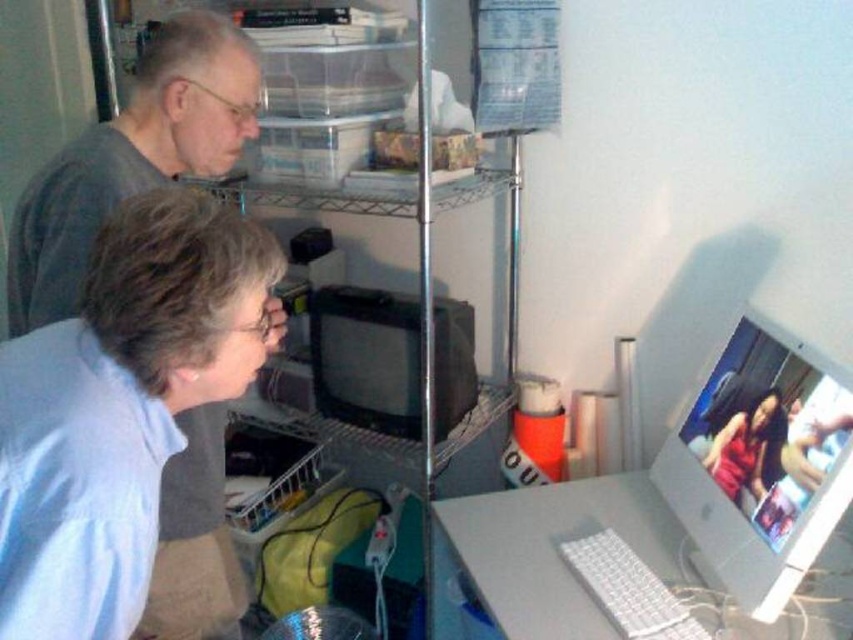
You are a delivery robot trying to navigate between two points in the image. The first point is at coordinate point [709,582] and the second is at point [747,419]. Which point is closer to you as you face the image?

Point [709,582] is further to the camera than point [747,419], so the point closer to you is point [747,419].

What are the coordinates of the matte silver monitor at center right?

The coordinates of the matte silver monitor at center right are 0.725 in the x axis and 0.893 in the y axis.

You are standing in front of the computer screen and notice two points marked on the monitor. Which point, point 1 at coordinates [778,477] or point 2 at coordinates [755,467], appears closer to you?

Point 1 at coordinates [778,477] is closer to the camera than point 2 at coordinates [755,467].